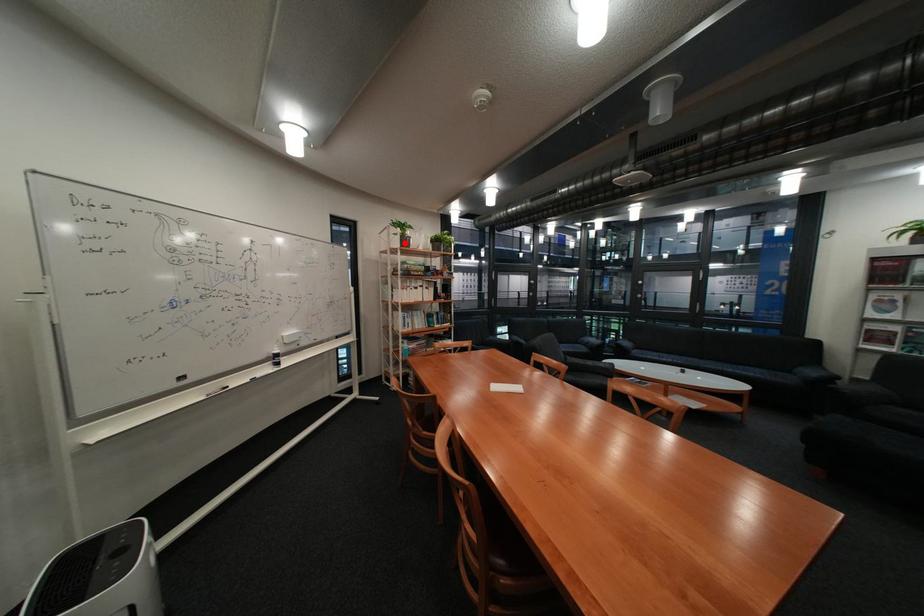
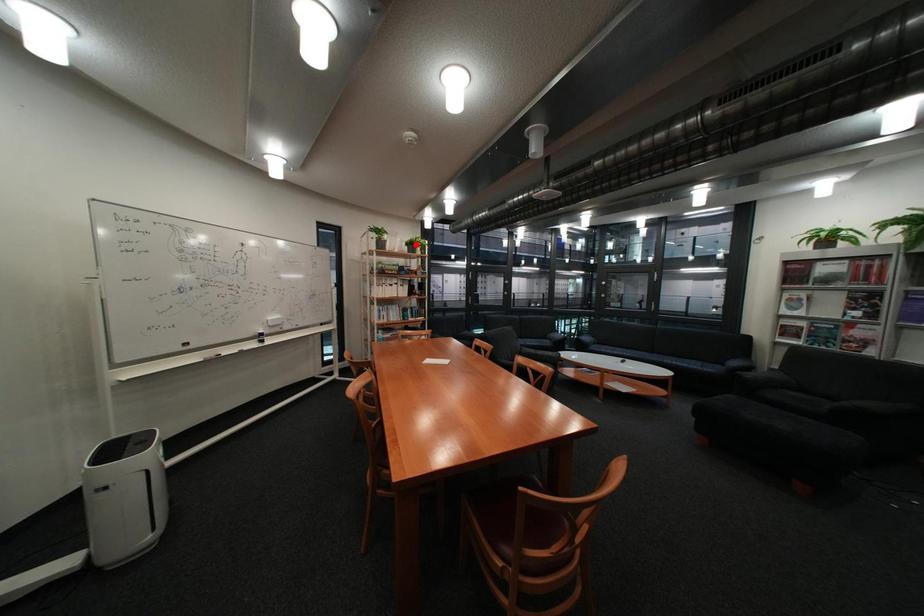
I am providing you with two images of the same scene from different viewpoints. A red point is marked on the first image and another point is marked on the second image. Is the marked point in image1 the same physical position as the marked point in image2?

No